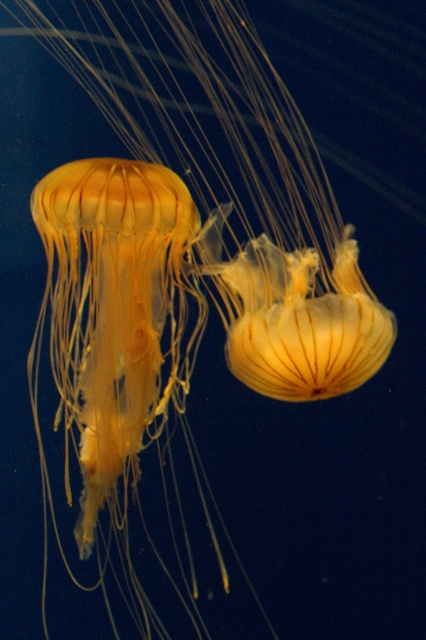
Question: Is translucent yellow jellyfish at center wider than translucent yellow jellyfish at left?

Choices:
 (A) no
 (B) yes

Answer: (B)

Question: Is translucent yellow jellyfish at center above translucent yellow jellyfish at left?

Choices:
 (A) yes
 (B) no

Answer: (A)

Question: Does translucent yellow jellyfish at center have a larger size compared to translucent yellow jellyfish at left?

Choices:
 (A) yes
 (B) no

Answer: (A)

Question: Among these objects, which one is nearest to the camera?

Choices:
 (A) translucent yellow jellyfish at center
 (B) translucent yellow jellyfish at left

Answer: (B)

Question: Which object is closer to the camera taking this photo?

Choices:
 (A) translucent yellow jellyfish at left
 (B) translucent yellow jellyfish at center

Answer: (A)

Question: Which of the following is the closest to the observer?

Choices:
 (A) (120, 56)
 (B) (155, 214)

Answer: (B)